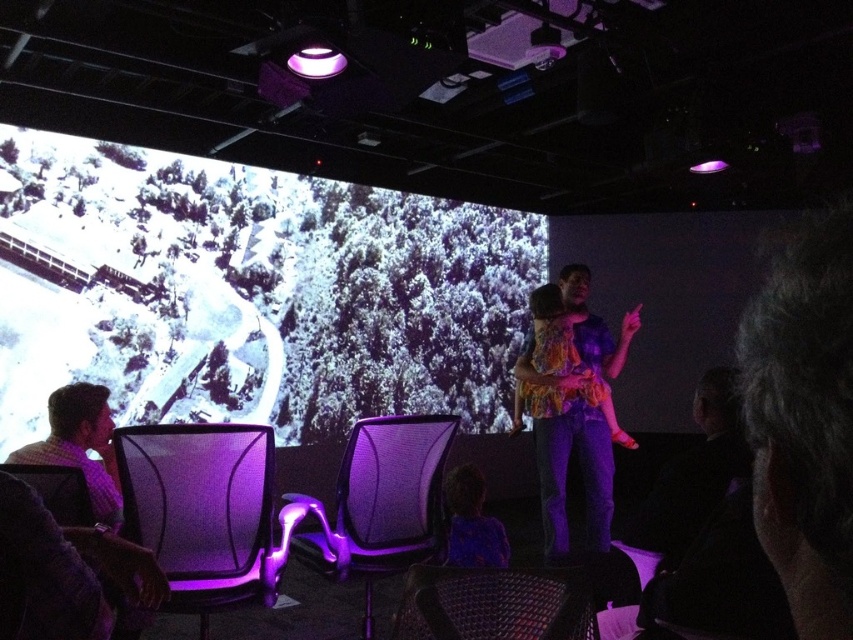
You are an event planner organizing a photoshoot in this presentation hall. You need to decide which outfit between the multicolored fabric shirt at center and the matte purple dress at lower center would be more visible to the audience. Based on their positions and the lighting, which one do you think will stand out more?

The multicolored fabric shirt at center will stand out more because it is positioned at the center of the stage, which is typically the focal point, and its varied colors likely catch the purple lighting better than the solid matte purple dress at lower center.

You are an attendee at the presentation. You want to take a photo of the speaker wearing the matte purple dress at lower center without the white matte projection screen at upper left appearing in the frame. Is this possible given their positions?

The white matte projection screen at upper left is positioned on the left side of the matte purple dress at lower center. Since the screen is to the left of the dress, you can adjust your camera angle to the right side of the dress to exclude the screen from the frame.

You are sitting in one of the chairs in the semi circle facing the stage. You notice two points marked on the stage. From your perspective, which point is closer to you, point at coordinates (488, 419) or point at coordinates (450, 522)?

Point at coordinates (450, 522) is closer to you because the description states that point at coordinates (488, 419) is behind point at coordinates (450, 522).